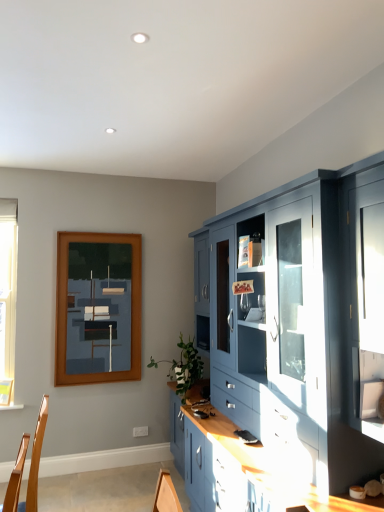
Question: Is matte blue cabinet at right aimed at wooden picture frame at upper left?

Choices:
 (A) no
 (B) yes

Answer: (B)

Question: Can you confirm if matte blue cabinet at right is shorter than wooden picture frame at upper left?

Choices:
 (A) no
 (B) yes

Answer: (A)

Question: Can you confirm if matte blue cabinet at right is taller than wooden picture frame at upper left?

Choices:
 (A) no
 (B) yes

Answer: (B)

Question: Is there a large distance between matte blue cabinet at right and wooden picture frame at upper left?

Choices:
 (A) yes
 (B) no

Answer: (A)

Question: Is matte blue cabinet at right positioned behind wooden picture frame at upper left?

Choices:
 (A) no
 (B) yes

Answer: (A)

Question: Is matte blue cabinet at right at the right side of wooden picture frame at upper left?

Choices:
 (A) no
 (B) yes

Answer: (B)

Question: Does wooden picture frame at upper left have a lesser height compared to matte blue cabinet at right?

Choices:
 (A) yes
 (B) no

Answer: (A)

Question: Is wooden picture frame at upper left turned away from matte blue cabinet at right?

Choices:
 (A) no
 (B) yes

Answer: (A)

Question: Does wooden picture frame at upper left have a smaller size compared to matte blue cabinet at right?

Choices:
 (A) no
 (B) yes

Answer: (B)

Question: From a real-world perspective, is wooden picture frame at upper left located higher than matte blue cabinet at right?

Choices:
 (A) yes
 (B) no

Answer: (A)

Question: Does wooden picture frame at upper left contain matte blue cabinet at right?

Choices:
 (A) no
 (B) yes

Answer: (A)

Question: Does wooden picture frame at upper left have a lesser width compared to matte blue cabinet at right?

Choices:
 (A) yes
 (B) no

Answer: (A)

Question: Is point (367, 170) positioned closer to the camera than point (87, 237)?

Choices:
 (A) closer
 (B) farther

Answer: (A)